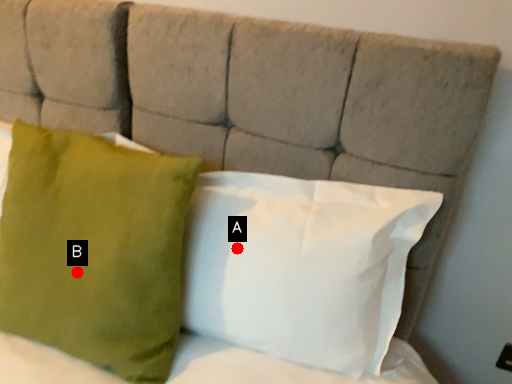
Question: Two points are circled on the image, labeled by A and B beside each circle. Which point appears farthest from the camera in this image?

Choices:
 (A) A is further
 (B) B is further

Answer: (A)